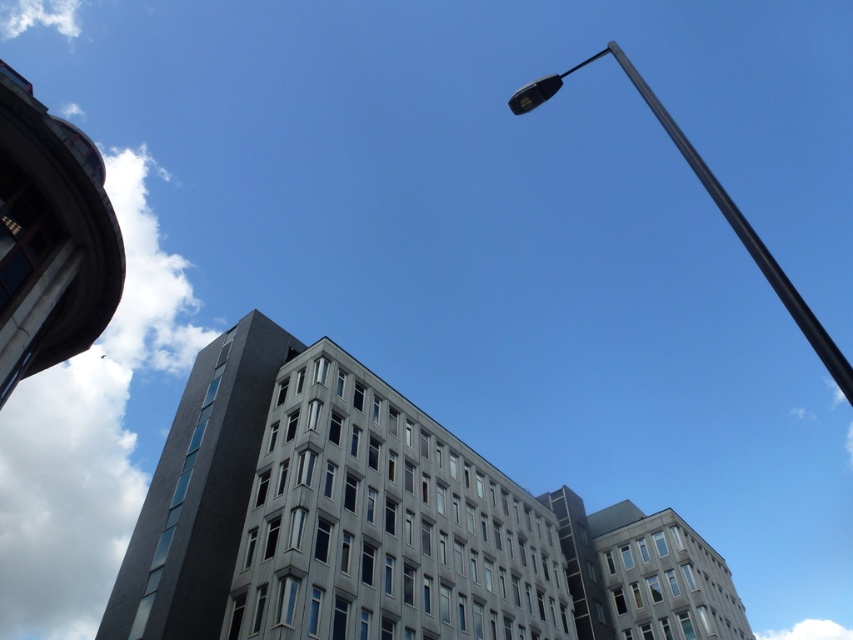
Can you confirm if gray concrete building at center is positioned to the right of black metallic street light at upper right?

In fact, gray concrete building at center is to the left of black metallic street light at upper right.

Between gray concrete building at center and black metallic street light at upper right, which one has more height?

black metallic street light at upper right

Which is in front, point (325, 490) or point (814, 324)?

Point (814, 324)

Locate an element on the screen. gray concrete building at center is located at coordinates (328, 513).

Which of these two, gray concrete building at center or dark gray concrete tower at upper left, stands shorter?

dark gray concrete tower at upper left

Does gray concrete building at center appear on the left side of dark gray concrete tower at upper left?

No, gray concrete building at center is not to the left of dark gray concrete tower at upper left.

This screenshot has width=853, height=640. What do you see at coordinates (328, 513) in the screenshot?
I see `gray concrete building at center` at bounding box center [328, 513].

The width and height of the screenshot is (853, 640). Find the location of `gray concrete building at center`. gray concrete building at center is located at coordinates (328, 513).

Who is more distant from viewer, (44, 280) or (846, 387)?

Positioned behind is point (44, 280).

Is point (54, 220) in front of point (552, 92)?

No.

The width and height of the screenshot is (853, 640). Identify the location of white concrete tower at upper left. (49, 237).